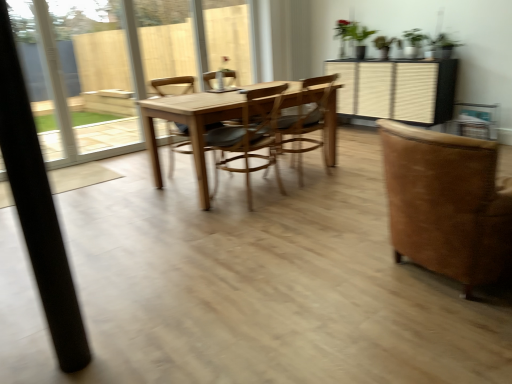
Question: Is point (357, 36) closer or farther from the camera than point (248, 193)?

Choices:
 (A) closer
 (B) farther

Answer: (B)

Question: In terms of width, does green matte plant at upper center look wider or thinner when compared to wooden at center, which is the 3th chair in right-to-left order?

Choices:
 (A) thin
 (B) wide

Answer: (A)

Question: Estimate the real-world distances between objects in this image. Which object is closer to the black matte pole at left?

Choices:
 (A) brown suede chair at right, the fourth chair from the left
 (B) green matte plant at upper center
 (C) wooden at center, which is the 3th chair in right-to-left order
 (D) wooden chair at center, the 2th chair viewed from the right
 (E) wooden chair at center, positioned as the first chair in left-to-right order

Answer: (A)

Question: Which is nearer to the black matte pole at left?

Choices:
 (A) wooden at center, arranged as the 2th chair when viewed from the left
 (B) green matte plant at upper center
 (C) wooden chair at center, positioned as the first chair in left-to-right order
 (D) brown suede chair at right, which ranks as the first chair in right-to-left order
 (E) wooden chair at center, the 2th chair viewed from the right

Answer: (D)